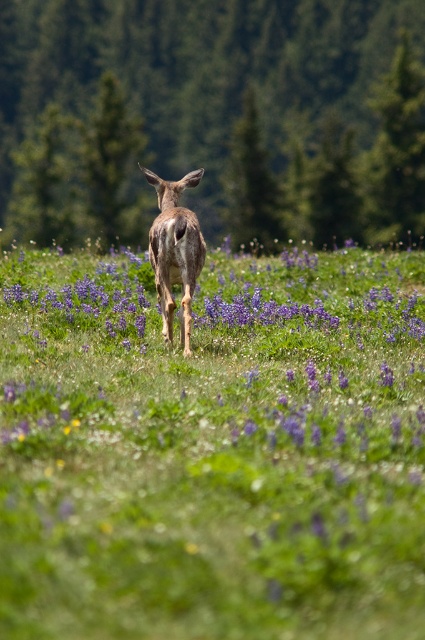
Does green grassy field at center have a larger size compared to shiny brown deer at center?

Correct, green grassy field at center is larger in size than shiny brown deer at center.

Does green grassy field at center have a greater height compared to shiny brown deer at center?

Indeed, green grassy field at center has a greater height compared to shiny brown deer at center.

This screenshot has width=425, height=640. What are the coordinates of `green grassy field at center` in the screenshot? It's located at (212, 449).